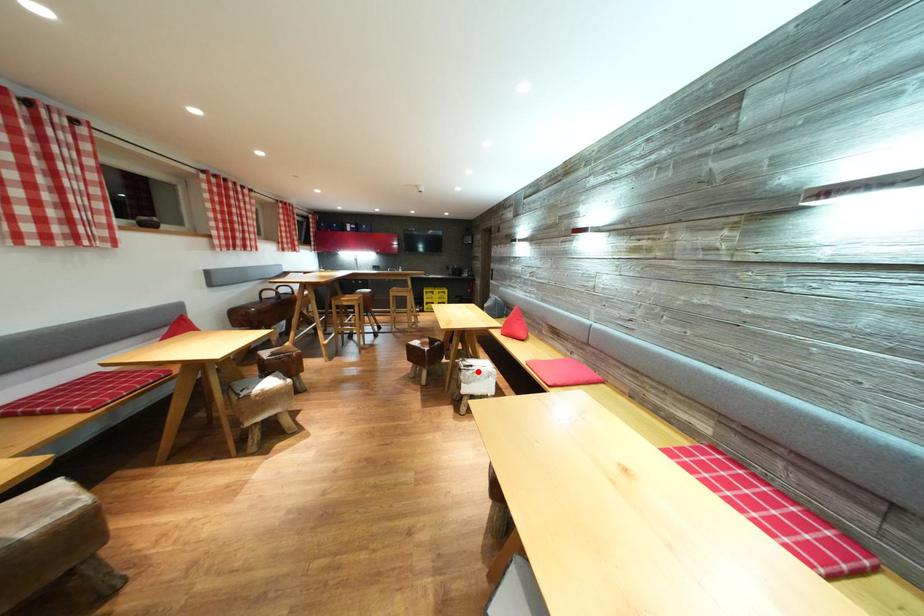
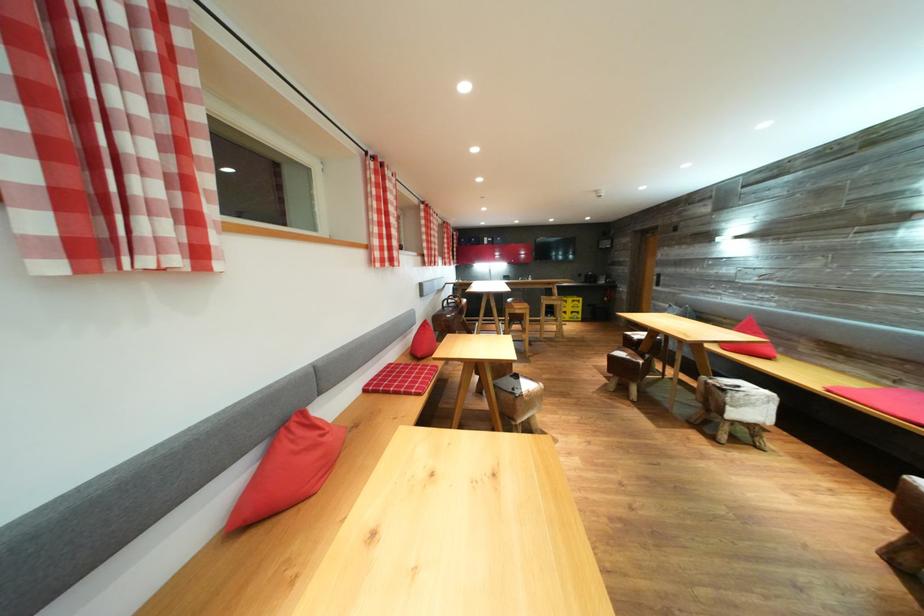
Question: I am providing you with two images of the same scene from different viewpoints. In image1, a red point is highlighted. Considering the same 3D point in image2, which of the following is correct?

Choices:
 (A) It is closer
 (B) It is farther

Answer: (B)